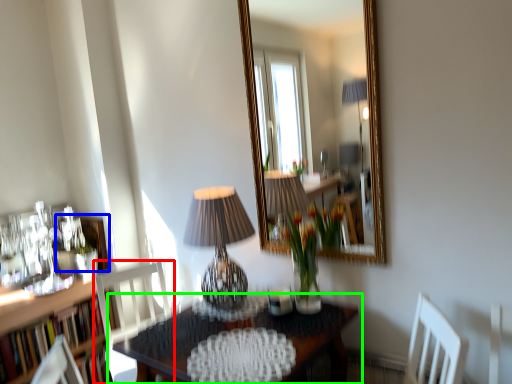
Question: Considering the real-world distances, which object is closest to chair (highlighted by a red box)? picture frame (highlighted by a blue box) or table (highlighted by a green box).

Choices:
 (A) picture frame
 (B) table

Answer: (A)